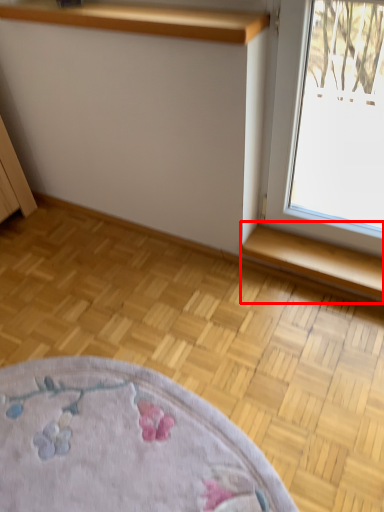
Question: Observing the image, what is the correct spatial positioning of window sill (annotated by the red box) in reference to shelf?

Choices:
 (A) right
 (B) left

Answer: (A)